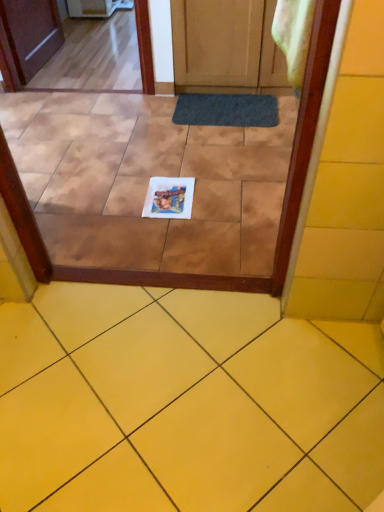
At what (x,y) coordinates should I click in order to perform the action: click on free point behind white glossy coaster at center. Please return your answer as a coordinate pair (x, y). The image size is (384, 512). Looking at the image, I should click on (171, 167).